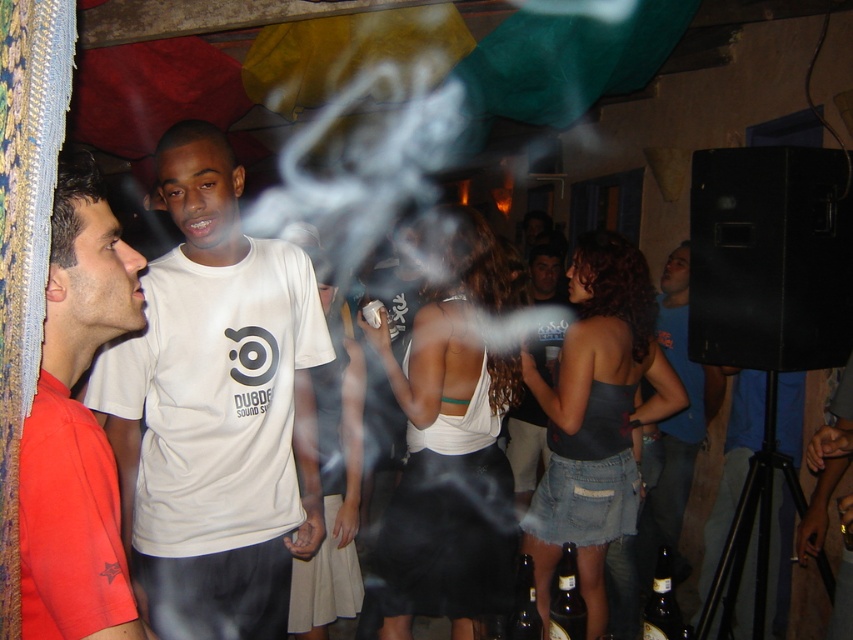
Question: Can you confirm if matte red shirt at left is thinner than brown glass bottle at lower center?

Choices:
 (A) yes
 (B) no

Answer: (A)

Question: Which point is closer to the camera?

Choices:
 (A) white t-shirt at center
 (B) white matte t-shirt at center

Answer: (B)

Question: Which point is farther to the camera?

Choices:
 (A) white matte t-shirt at center
 (B) matte red shirt at left
 (C) brown glass bottle at lower center

Answer: (C)

Question: Is matte red shirt at left bigger than blue denim jeans at lower right?

Choices:
 (A) yes
 (B) no

Answer: (B)

Question: Is brown glass bottle at lower center behind brown glass bottle at lower right?

Choices:
 (A) no
 (B) yes

Answer: (B)

Question: Which point appears closest to the camera in this image?

Choices:
 (A) pyautogui.click(x=186, y=445)
 (B) pyautogui.click(x=666, y=285)
 (C) pyautogui.click(x=85, y=218)

Answer: (C)